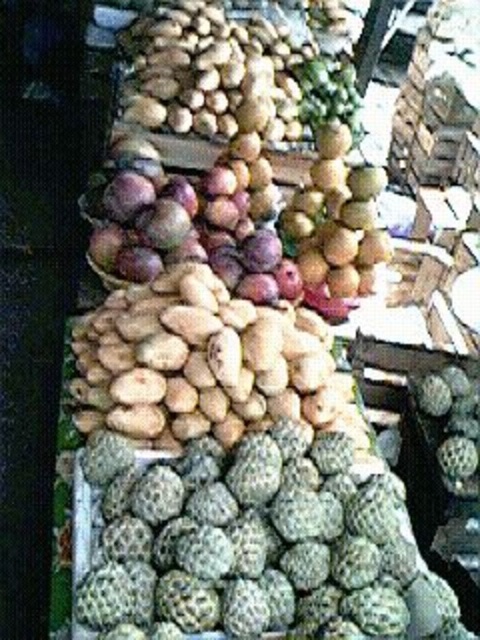
Question: Does green rough textured fruit at lower center come behind smooth brown nuts at center?

Choices:
 (A) yes
 (B) no

Answer: (B)

Question: Which point is farther to the camera?

Choices:
 (A) click(x=151, y=150)
 (B) click(x=324, y=461)

Answer: (A)

Question: Is green rough textured fruit at lower center to the left of smooth brown nuts at center from the viewer's perspective?

Choices:
 (A) yes
 (B) no

Answer: (A)

Question: Which point is closer to the camera?

Choices:
 (A) green rough textured fruit at lower center
 (B) smooth brown nuts at center

Answer: (A)

Question: Which object appears farthest from the camera in this image?

Choices:
 (A) shiny purple plums at center
 (B) green rough textured fruit at lower center

Answer: (A)

Question: Is green rough textured fruit at lower center bigger than smooth brown nuts at center?

Choices:
 (A) no
 (B) yes

Answer: (B)